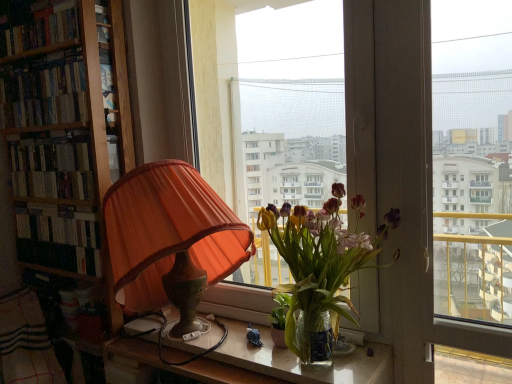
Describe the element at coordinates (52, 166) in the screenshot. I see `hardcover books at left, acting as the 3th book starting from the top` at that location.

The width and height of the screenshot is (512, 384). What do you see at coordinates (37, 26) in the screenshot?
I see `hardcover books at upper left, which ranks as the 3th book in bottom-to-top order` at bounding box center [37, 26].

What is the approximate width of hardcover books at left, the second book in the bottom-to-top sequence?

It is 4.68 inches.

What do you see at coordinates (26, 342) in the screenshot? Image resolution: width=512 pixels, height=384 pixels. I see `plaid fabric at lower left` at bounding box center [26, 342].

What do you see at coordinates (168, 231) in the screenshot? This screenshot has height=384, width=512. I see `orange fabric lampshade at left` at bounding box center [168, 231].

At what (x,y) coordinates should I click in order to perform the action: click on hardcover books at left, the 1th book when ordered from bottom to top. Please return your answer as a coordinate pair (x, y). Looking at the image, I should click on (52, 166).

Does orange fabric lampshade at left have a lesser height compared to hardcover books at left, which ranks as the second book in top-to-bottom order?

No, orange fabric lampshade at left is not shorter than hardcover books at left, which ranks as the second book in top-to-bottom order.

Which of these two, orange fabric lampshade at left or hardcover books at left, which ranks as the second book in top-to-bottom order, is thinner?

With smaller width is hardcover books at left, which ranks as the second book in top-to-bottom order.

Is orange fabric lampshade at left at the right side of hardcover books at left, which ranks as the second book in top-to-bottom order?

Yes, orange fabric lampshade at left is to the right of hardcover books at left, which ranks as the second book in top-to-bottom order.

In the scene shown: Is there a large distance between translucent glass table at lower center and hardcover books at upper left, which ranks as the 1th book in top-to-bottom order?

Indeed, translucent glass table at lower center is not near hardcover books at upper left, which ranks as the 1th book in top-to-bottom order.

Consider the image. Between translucent glass table at lower center and hardcover books at upper left, which ranks as the 3th book in bottom-to-top order, which one appears on the left side from the viewer's perspective?

hardcover books at upper left, which ranks as the 3th book in bottom-to-top order.

How different are the orientations of translucent glass table at lower center and hardcover books at upper left, which ranks as the 1th book in top-to-bottom order, in degrees?

They differ by 0.119 degrees in their facing directions.

From the image's perspective, is translucent glass table at lower center located beneath hardcover books at upper left, which ranks as the 3th book in bottom-to-top order?

Yes, from the image's perspective, translucent glass table at lower center is below hardcover books at upper left, which ranks as the 3th book in bottom-to-top order.

Who is shorter, hardcover books at upper left, which ranks as the 3th book in bottom-to-top order, or hardcover books at left, the 1th book when ordered from bottom to top?

hardcover books at upper left, which ranks as the 3th book in bottom-to-top order.

How many degrees apart are the facing directions of hardcover books at upper left, which ranks as the 3th book in bottom-to-top order, and hardcover books at left, acting as the 3th book starting from the top?

The angular difference between hardcover books at upper left, which ranks as the 3th book in bottom-to-top order, and hardcover books at left, acting as the 3th book starting from the top, is 0.00245 degrees.

Does hardcover books at upper left, which ranks as the 3th book in bottom-to-top order, touch hardcover books at left, acting as the 3th book starting from the top?

No, hardcover books at upper left, which ranks as the 3th book in bottom-to-top order, is not touching hardcover books at left, acting as the 3th book starting from the top.

From the image's perspective, is hardcover books at upper left, which ranks as the 3th book in bottom-to-top order, above or below hardcover books at left, acting as the 3th book starting from the top?

hardcover books at upper left, which ranks as the 3th book in bottom-to-top order, is above hardcover books at left, acting as the 3th book starting from the top.

Is hardcover books at upper left, which ranks as the 1th book in top-to-bottom order, to the right of orange fabric lampshade at left from the viewer's perspective?

No, hardcover books at upper left, which ranks as the 1th book in top-to-bottom order, is not to the right of orange fabric lampshade at left.

From the image's perspective, is hardcover books at upper left, which ranks as the 1th book in top-to-bottom order, located above orange fabric lampshade at left?

Yes, from the image's perspective, hardcover books at upper left, which ranks as the 1th book in top-to-bottom order, is over orange fabric lampshade at left.

Is hardcover books at upper left, which ranks as the 3th book in bottom-to-top order, positioned far away from orange fabric lampshade at left?

No.

In order to click on the 2nd book behind the translucent glass vase at center in this screenshot , I will do `click(44, 91)`.

Considering the sizes of hardcover books at left, the second book in the bottom-to-top sequence, and translucent glass vase at center in the image, is hardcover books at left, the second book in the bottom-to-top sequence, wider or thinner than translucent glass vase at center?

hardcover books at left, the second book in the bottom-to-top sequence, is thinner than translucent glass vase at center.

Based on the photo, considering the sizes of objects hardcover books at left, the second book in the bottom-to-top sequence, and translucent glass vase at center in the image provided, who is smaller, hardcover books at left, the second book in the bottom-to-top sequence, or translucent glass vase at center?

Smaller between the two is hardcover books at left, the second book in the bottom-to-top sequence.

Is hardcover books at left, which ranks as the second book in top-to-bottom order, facing away from translucent glass vase at center?

That's not correct — hardcover books at left, which ranks as the second book in top-to-bottom order, is not looking away from translucent glass vase at center.

From the image's perspective, who appears lower, hardcover books at left, the 1th book when ordered from bottom to top, or hardcover books at upper left, which ranks as the 3th book in bottom-to-top order?

hardcover books at left, the 1th book when ordered from bottom to top, from the image's perspective.

Considering the relative sizes of hardcover books at left, the 1th book when ordered from bottom to top, and hardcover books at upper left, which ranks as the 1th book in top-to-bottom order, in the image provided, is hardcover books at left, the 1th book when ordered from bottom to top, shorter than hardcover books at upper left, which ranks as the 1th book in top-to-bottom order,?

In fact, hardcover books at left, the 1th book when ordered from bottom to top, may be taller than hardcover books at upper left, which ranks as the 1th book in top-to-bottom order.

From a real-world perspective, is hardcover books at left, acting as the 3th book starting from the top, located higher than hardcover books at upper left, which ranks as the 3th book in bottom-to-top order?

No, from a real-world perspective, hardcover books at left, acting as the 3th book starting from the top, is not above hardcover books at upper left, which ranks as the 3th book in bottom-to-top order.

Where is `the 2nd book in front of the hardcover books at left, the 1th book when ordered from bottom to top`? This screenshot has width=512, height=384. the 2nd book in front of the hardcover books at left, the 1th book when ordered from bottom to top is located at coordinates (37, 26).

In the image, is hardcover books at left, which ranks as the second book in top-to-bottom order, positioned in front of or behind translucent glass table at lower center?

Clearly, hardcover books at left, which ranks as the second book in top-to-bottom order, is behind translucent glass table at lower center.

From the image's perspective, between hardcover books at left, which ranks as the second book in top-to-bottom order, and translucent glass table at lower center, which one is located above?

hardcover books at left, which ranks as the second book in top-to-bottom order, appears higher in the image.

The image size is (512, 384). Find the location of `table located in front of the hardcover books at left, the second book in the bottom-to-top sequence`. table located in front of the hardcover books at left, the second book in the bottom-to-top sequence is located at coordinates (257, 362).

Based on the photo, looking at their sizes, would you say hardcover books at left, the second book in the bottom-to-top sequence, is wider or thinner than translucent glass table at lower center?

Considering their sizes, hardcover books at left, the second book in the bottom-to-top sequence, looks slimmer than translucent glass table at lower center.

The image size is (512, 384). In order to click on the 2nd book behind the orange fabric lampshade at left, counting from the anchor's position in this screenshot , I will do `click(44, 91)`.

At what (x,y) coordinates should I click in order to perform the action: click on table that appears below the hardcover books at upper left, which ranks as the 3th book in bottom-to-top order (from the image's perspective). Please return your answer as a coordinate pair (x, y). The width and height of the screenshot is (512, 384). Looking at the image, I should click on (257, 362).

When comparing their distances from transparent glass window at center, does translucent glass table at lower center or hardcover books at left, acting as the 3th book starting from the top, seem closer?

Among the two, translucent glass table at lower center is located nearer to transparent glass window at center.

Considering their positions, is hardcover books at left, the second book in the bottom-to-top sequence, positioned further to hardcover books at left, the 1th book when ordered from bottom to top, than hardcover books at upper left, which ranks as the 1th book in top-to-bottom order?

hardcover books at upper left, which ranks as the 1th book in top-to-bottom order.

Which object lies nearer to the anchor point hardcover books at upper left, which ranks as the 1th book in top-to-bottom order, hardcover books at left, the second book in the bottom-to-top sequence, or orange fabric lampshade at left?

hardcover books at left, the second book in the bottom-to-top sequence, lies closer to hardcover books at upper left, which ranks as the 1th book in top-to-bottom order, than the other object.

Looking at the image, which one is located closer to transparent glass window at center, hardcover books at left, the 1th book when ordered from bottom to top, or translucent glass vase at center?

translucent glass vase at center is closer to transparent glass window at center.

Considering their positions, is plaid fabric at lower left positioned closer to translucent glass table at lower center than hardcover books at left, the 1th book when ordered from bottom to top?

The object closer to translucent glass table at lower center is plaid fabric at lower left.

When comparing their distances from hardcover books at upper left, which ranks as the 1th book in top-to-bottom order, does hardcover books at left, which ranks as the second book in top-to-bottom order, or hardcover books at left, the 1th book when ordered from bottom to top, seem closer?

Based on the image, hardcover books at left, which ranks as the second book in top-to-bottom order, appears to be nearer to hardcover books at upper left, which ranks as the 1th book in top-to-bottom order.

From the image, which object appears to be nearer to translucent glass table at lower center, hardcover books at upper left, which ranks as the 1th book in top-to-bottom order, or hardcover books at left, which ranks as the second book in top-to-bottom order?

hardcover books at left, which ranks as the second book in top-to-bottom order, is closer to translucent glass table at lower center.

Looking at the image, which one is located closer to hardcover books at left, the second book in the bottom-to-top sequence, translucent glass vase at center or hardcover books at left, the 1th book when ordered from bottom to top?

Among the two, hardcover books at left, the 1th book when ordered from bottom to top, is located nearer to hardcover books at left, the second book in the bottom-to-top sequence.

The width and height of the screenshot is (512, 384). Find the location of `lamp located between hardcover books at left, the second book in the bottom-to-top sequence, and translucent glass vase at center in the left-right direction`. lamp located between hardcover books at left, the second book in the bottom-to-top sequence, and translucent glass vase at center in the left-right direction is located at coordinates (168, 231).

This screenshot has height=384, width=512. Find the location of `book situated between hardcover books at left, which ranks as the second book in top-to-bottom order, and transparent glass window at center from left to right`. book situated between hardcover books at left, which ranks as the second book in top-to-bottom order, and transparent glass window at center from left to right is located at coordinates (52, 166).

The width and height of the screenshot is (512, 384). I want to click on lamp between hardcover books at left, acting as the 3th book starting from the top, and transparent glass window at center, so click(x=168, y=231).

Locate an element on the screen. table between plaid fabric at lower left and translucent glass vase at center from left to right is located at coordinates (257, 362).